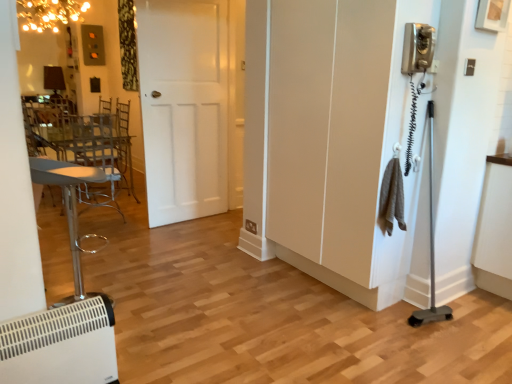
At what (x,y) coordinates should I click in order to perform the action: click on free location in front of white matte screen door at right. Please return your answer as a coordinate pair (x, y). Looking at the image, I should click on [x=342, y=336].